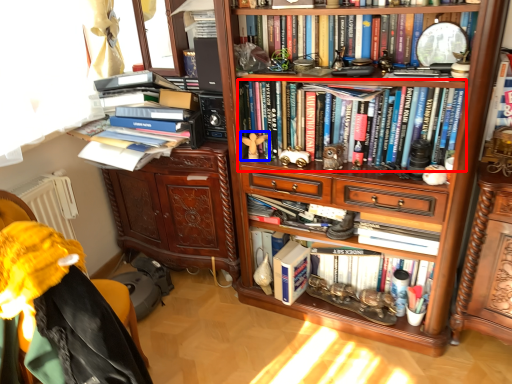
Question: Among these objects, which one is nearest to the camera, book (highlighted by a red box) or toy (highlighted by a blue box)?

Choices:
 (A) book
 (B) toy

Answer: (A)